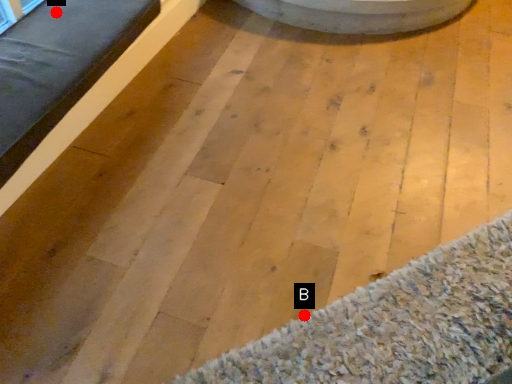
Question: Two points are circled on the image, labeled by A and B beside each circle. Among these points, which one is nearest to the camera?

Choices:
 (A) A is closer
 (B) B is closer

Answer: (B)